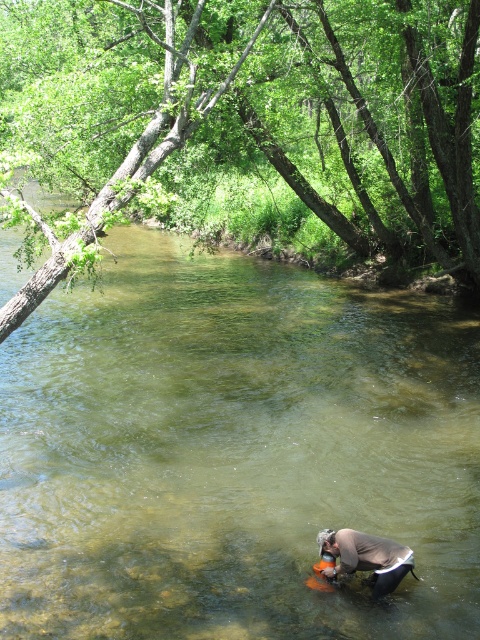
You are a hiker who wants to cross the clear water at center to reach the green leafy tree at upper left. Based on the scene, is the water shallow enough for you to walk through without getting your waist submerged?

The clear water at center is not as tall as the green leafy tree at upper left. Since the water is described as shallow with a visible sandy and rocky bottom and ripples indicating movement, it suggests the water depth is manageable for walking through without submerging the waist.

You are a photographer planning to take a picture of the green leafy tree at upper left and the light brown fabric at lower center. Which object should you focus on first if you want to capture both in a single frame without moving the camera?

You should focus on the green leafy tree at upper left first because it is larger in size than the light brown fabric at lower center, making it more prominent in the frame.